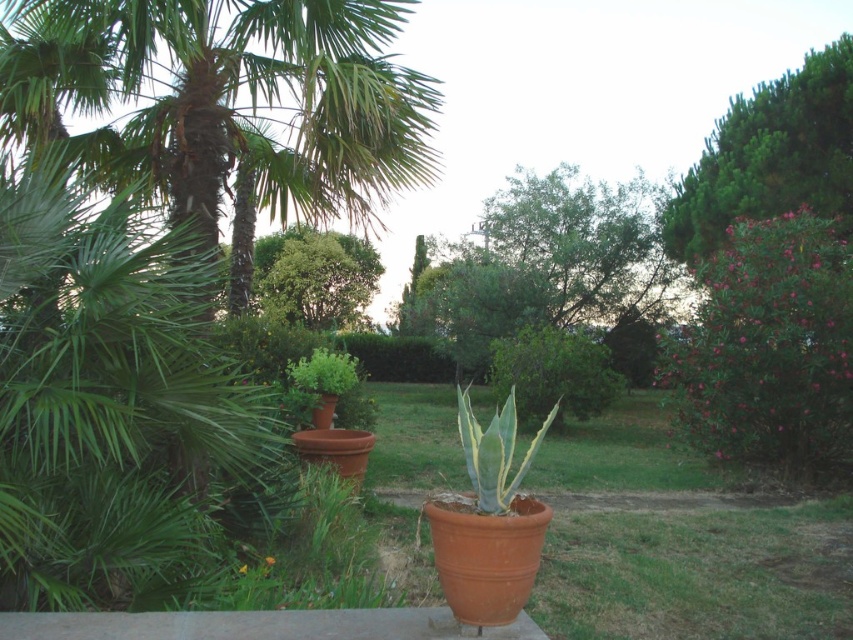
The image size is (853, 640). What do you see at coordinates (770, 156) in the screenshot?
I see `green leafy tree at upper right` at bounding box center [770, 156].

Does point (668, 230) come behind point (310, 264)?

No, it is in front of (310, 264).

This screenshot has height=640, width=853. Find the location of `green leafy tree at upper right`. green leafy tree at upper right is located at coordinates (770, 156).

Looking at this image, who is lower down, green leafy bush at upper center or green leafy bush at center?

Positioned lower is green leafy bush at center.

The image size is (853, 640). Identify the location of green leafy bush at upper center. (314, 276).

What do you see at coordinates (769, 348) in the screenshot?
I see `pink glossy bush at upper right` at bounding box center [769, 348].

You are a GUI agent. You are given a task and a screenshot of the screen. Output one action in this format:
    pyautogui.click(x=<x>, y=<y>)
    Task: Click on the pink glossy bush at upper right
    The height and width of the screenshot is (640, 853).
    Given the screenshot: What is the action you would take?
    pyautogui.click(x=769, y=348)